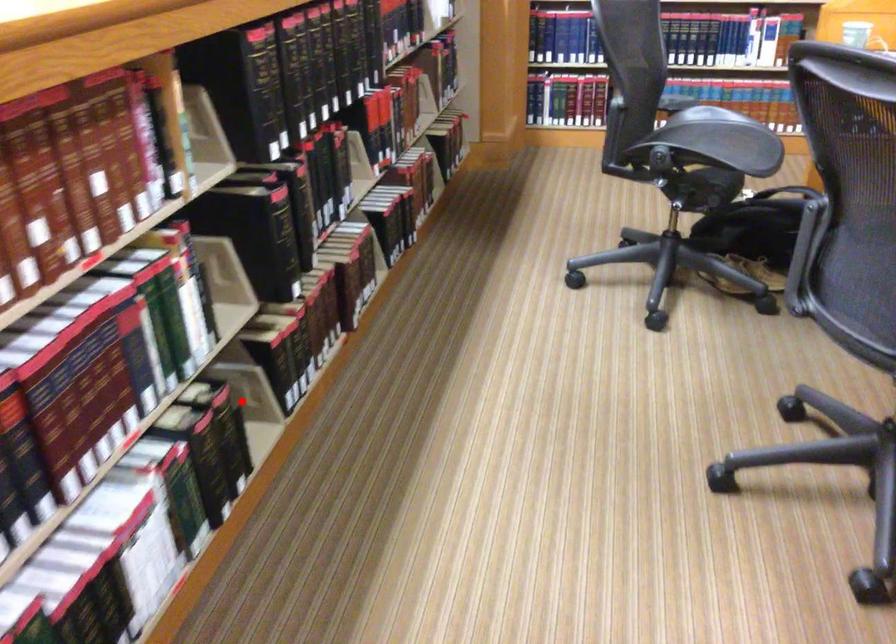
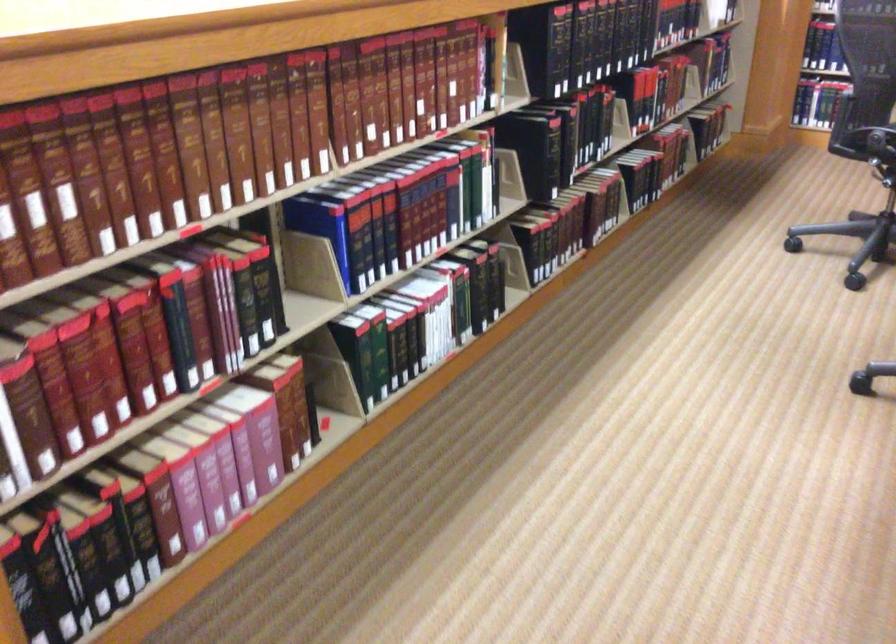
Find the pixel in the second image that matches the highlighted location in the first image.

(506, 267)